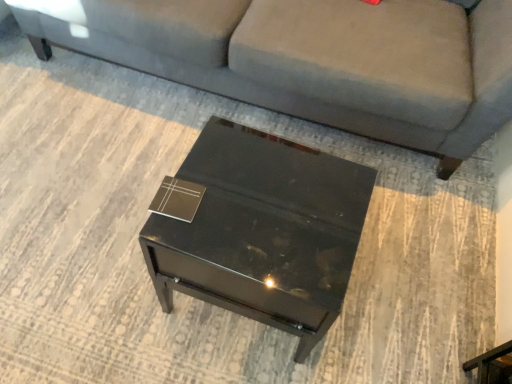
Question: Is matte black book at center bigger or smaller than glossy black side table at center?

Choices:
 (A) big
 (B) small

Answer: (B)

Question: From the image's perspective, is matte black book at center positioned above or below glossy black side table at center?

Choices:
 (A) below
 (B) above

Answer: (B)

Question: Which object is positioned farthest from the glossy black side table at center?

Choices:
 (A) gray fabric couch at center
 (B) matte black book at center

Answer: (A)

Question: Which object is the closest to the glossy black side table at center?

Choices:
 (A) gray fabric couch at center
 (B) matte black book at center

Answer: (B)